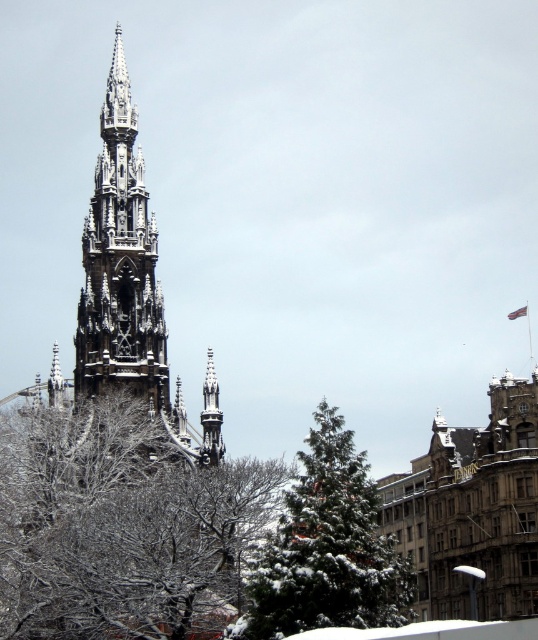
Which is below, green textured tree at center or dark gray stone spire at center?

green textured tree at center is lower down.

Who is more distant from viewer, [315,548] or [121,236]?

Positioned behind is point [121,236].

What do you see at coordinates (329, 547) in the screenshot? I see `green textured tree at center` at bounding box center [329, 547].

This screenshot has width=538, height=640. Find the location of `green textured tree at center`. green textured tree at center is located at coordinates coord(329,547).

Does snow-covered branches at center appear over green textured tree at center?

Yes, snow-covered branches at center is above green textured tree at center.

Is point (66, 576) behind point (367, 536)?

That is False.

You are a GUI agent. You are given a task and a screenshot of the screen. Output one action in this format:
    pyautogui.click(x=<x>, y=<y>)
    Task: Click on the snow-covered branches at center
    The height and width of the screenshot is (640, 538).
    Given the screenshot: What is the action you would take?
    pyautogui.click(x=121, y=525)

Is snow-covered branches at center to the left of dark gray stone spire at center from the viewer's perspective?

No, snow-covered branches at center is not to the left of dark gray stone spire at center.

Locate an element on the screen. snow-covered branches at center is located at coordinates (121, 525).

Which is in front, point (187, 611) or point (144, 305)?

Point (187, 611) is in front.

The height and width of the screenshot is (640, 538). I want to click on snow-covered branches at center, so click(x=121, y=525).